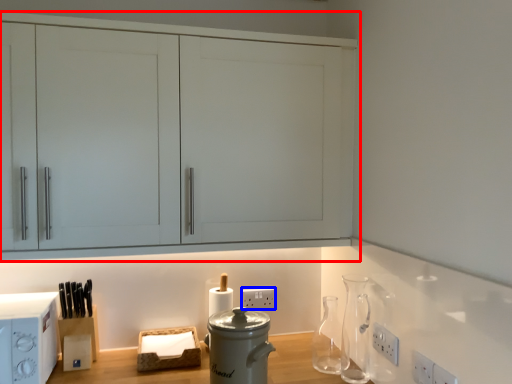
Question: Which object appears closest to the camera in this image, cabinetry (highlighted by a red box) or electric outlet (highlighted by a blue box)?

Choices:
 (A) cabinetry
 (B) electric outlet

Answer: (A)